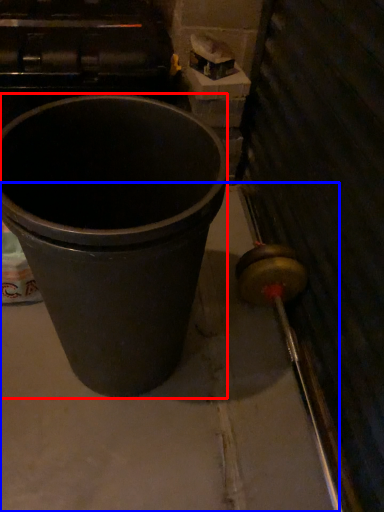
Question: Which object is further to the camera taking this photo, waste container (highlighted by a red box) or concrete (highlighted by a blue box)?

Choices:
 (A) waste container
 (B) concrete

Answer: (B)